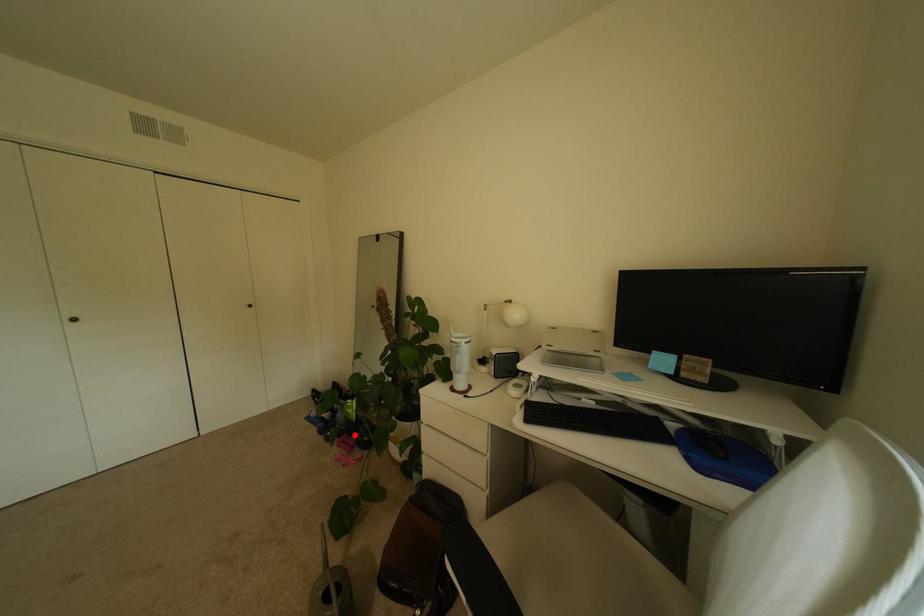
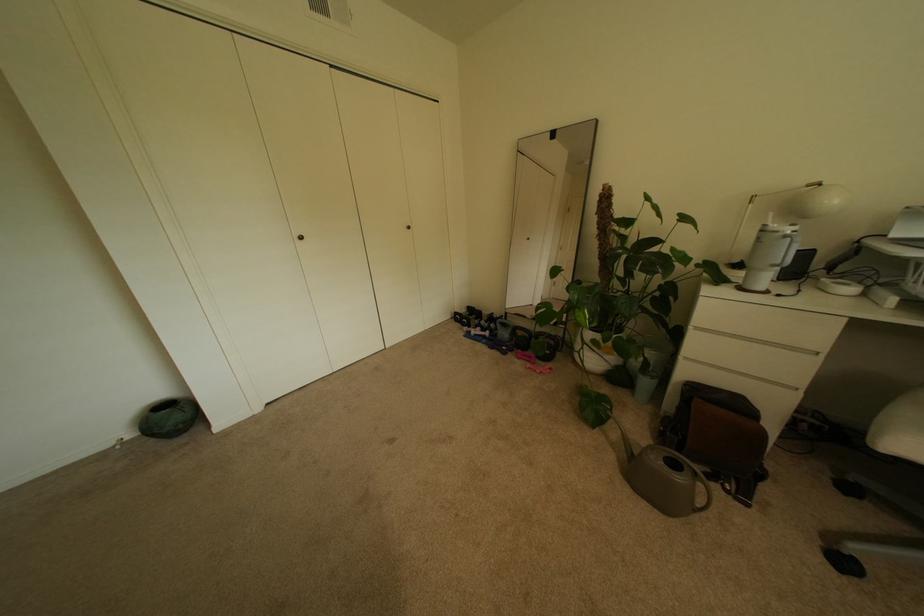
Question: I am providing you with two images of the same scene from different viewpoints. A red point is shown in image1. For the corresponding object point in image2, is it positioned nearer or farther from the camera?

Choices:
 (A) Nearer
 (B) Farther

Answer: (A)